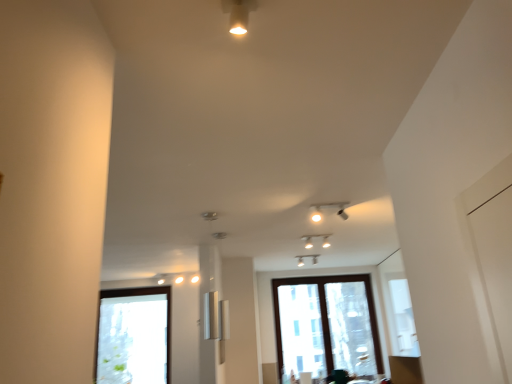
Question: Considering the positions of clear glass window at center, positioned as the 1th window in right-to-left order, and clear glass window at lower left, the second window positioned from the right, in the image, is clear glass window at center, positioned as the 1th window in right-to-left order, taller or shorter than clear glass window at lower left, the second window positioned from the right,?

Choices:
 (A) short
 (B) tall

Answer: (B)

Question: From the image's perspective, is clear glass window at center, positioned as the 1th window in right-to-left order, positioned above or below clear glass window at lower left, the second window positioned from the right?

Choices:
 (A) above
 (B) below

Answer: (A)

Question: Considering the positions of clear glass window at center, which is the 2th window in left-to-right order, and clear glass window at lower left, the second window positioned from the right, in the image, is clear glass window at center, which is the 2th window in left-to-right order, wider or thinner than clear glass window at lower left, the second window positioned from the right,?

Choices:
 (A) thin
 (B) wide

Answer: (A)

Question: Based on their positions, is clear glass window at lower left, the second window positioned from the right, located to the left or right of clear glass window at center, positioned as the 1th window in right-to-left order?

Choices:
 (A) right
 (B) left

Answer: (B)

Question: In terms of width, does clear glass window at lower left, the second window positioned from the right, look wider or thinner when compared to clear glass window at center, which is the 2th window in left-to-right order?

Choices:
 (A) wide
 (B) thin

Answer: (A)

Question: From a real-world perspective, relative to clear glass window at center, positioned as the 1th window in right-to-left order, is clear glass window at lower left, the second window positioned from the right, vertically above or below?

Choices:
 (A) below
 (B) above

Answer: (B)

Question: Is clear glass window at lower left, positioned as the 1th window in left-to-right order, bigger or smaller than clear glass window at center, which is the 2th window in left-to-right order?

Choices:
 (A) small
 (B) big

Answer: (B)